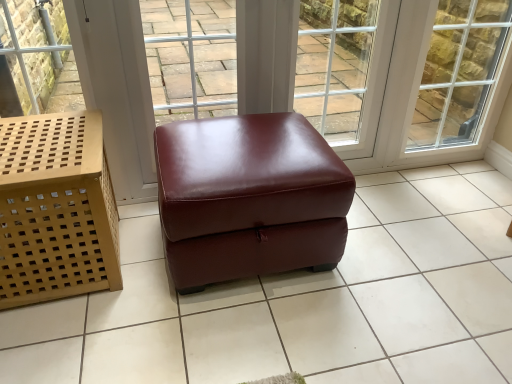
Locate an element on the screen. vacant space in front of burgundy leather ottoman at center is located at coordinates (239, 337).